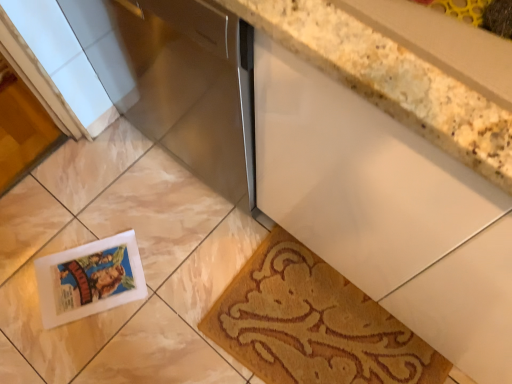
At what (x,y) coordinates should I click in order to perform the action: click on free area below brown textured mat at lower right (from a real-world perspective). Please return your answer as a coordinate pair (x, y). Looking at the image, I should click on (305, 324).